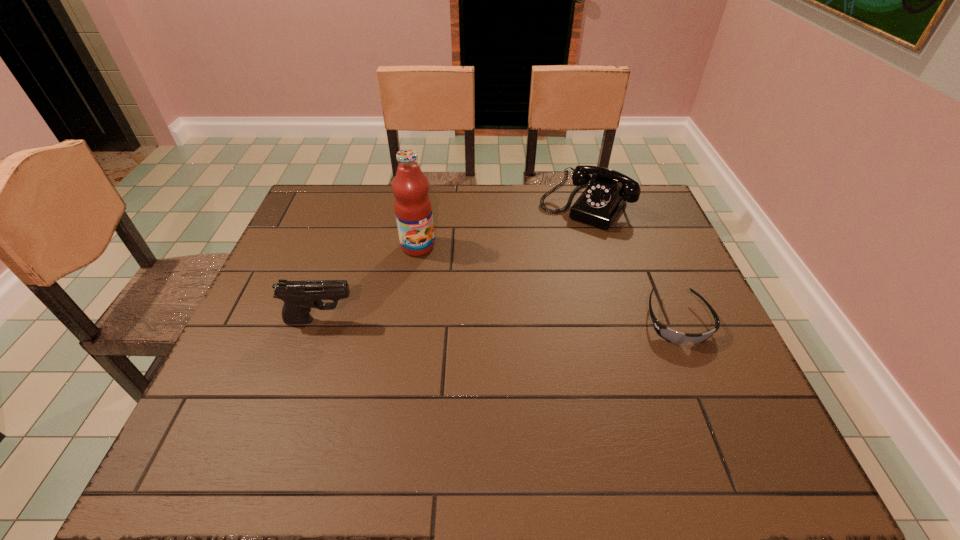
This screenshot has width=960, height=540. I want to click on free area in between the shortest object and the pistol, so click(499, 321).

Locate an element on the screen. This screenshot has height=540, width=960. free point between the shortest object and the third object from right to left is located at coordinates (547, 284).

Point out which object is positioned as the second nearest to the second farthest object. Please provide its 2D coordinates. Your answer should be formatted as a tuple, i.e. [(x, y)], where the tuple contains the x and y coordinates of a point satisfying the conditions above.

[(600, 203)]

Identify the location of object that stands as the closest to the leftmost object. This screenshot has width=960, height=540. (413, 209).